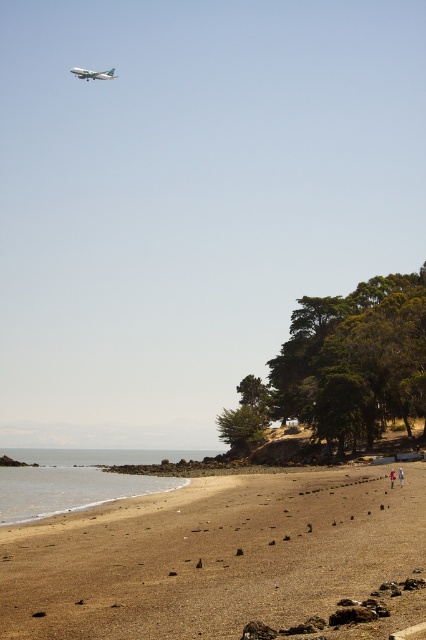
Looking at this image, between silver metallic airplane at upper left and pink fabric person at lower right, which one appears on the right side from the viewer's perspective?

pink fabric person at lower right

Is silver metallic airplane at upper left to the left of pink fabric person at lower right from the viewer's perspective?

Yes, silver metallic airplane at upper left is to the left of pink fabric person at lower right.

Locate an element on the screen. The image size is (426, 640). silver metallic airplane at upper left is located at coordinates (92, 74).

Does brown sandy beach at lower center have a greater width compared to white fabric person at lower right?

Indeed, brown sandy beach at lower center has a greater width compared to white fabric person at lower right.

Does brown sandy beach at lower center appear on the left side of white fabric person at lower right?

Correct, you'll find brown sandy beach at lower center to the left of white fabric person at lower right.

Between point (411, 552) and point (393, 468), which one is positioned behind?

The point (393, 468) is more distant.

Locate an element on the screen. brown sandy beach at lower center is located at coordinates (212, 556).

Who is positioned more to the left, brown sandy beach at lower center or silver metallic airplane at upper left?

Positioned to the left is silver metallic airplane at upper left.

Is the position of brown sandy beach at lower center more distant than that of silver metallic airplane at upper left?

That is False.

Who is more forward, (169,637) or (81,76)?

Positioned in front is point (169,637).

Locate an element on the screen. The width and height of the screenshot is (426, 640). brown sandy beach at lower center is located at coordinates (212, 556).